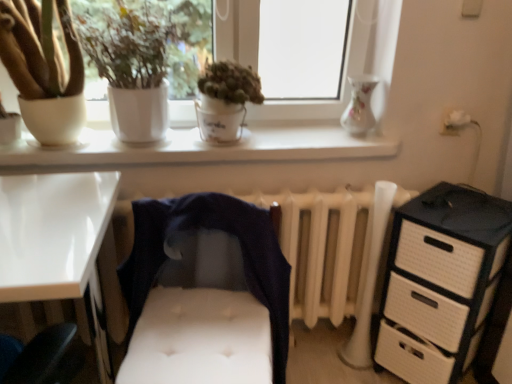
Question: Looking at the image, does white glossy window sill at upper center seem bigger or smaller compared to white matte pot at upper left, positioned as the 2th houseplant in right-to-left order?

Choices:
 (A) big
 (B) small

Answer: (B)

Question: Is white glossy window sill at upper center wider or thinner than white matte pot at upper left, which is the second houseplant from left to right?

Choices:
 (A) wide
 (B) thin

Answer: (B)

Question: Based on their relative distances, which object is nearer to the matte white pot at left, positioned as the 1th houseplant in left-to-right order?

Choices:
 (A) white woven chest of drawers at right
 (B) white glossy window sill at upper center
 (C) green matte plant at center, acting as the third houseplant starting from the left
 (D) white glossy desk at lower left
 (E) white glossy window at upper center

Answer: (E)

Question: Which is farther from the dark blue fabric at center?

Choices:
 (A) matte white pot at left, the 3th houseplant viewed from the right
 (B) white glossy window sill at upper center
 (C) green matte plant at center, placed as the 1th houseplant when sorted from right to left
 (D) porcelain floral vase at upper right
 (E) white glossy desk at lower left

Answer: (D)